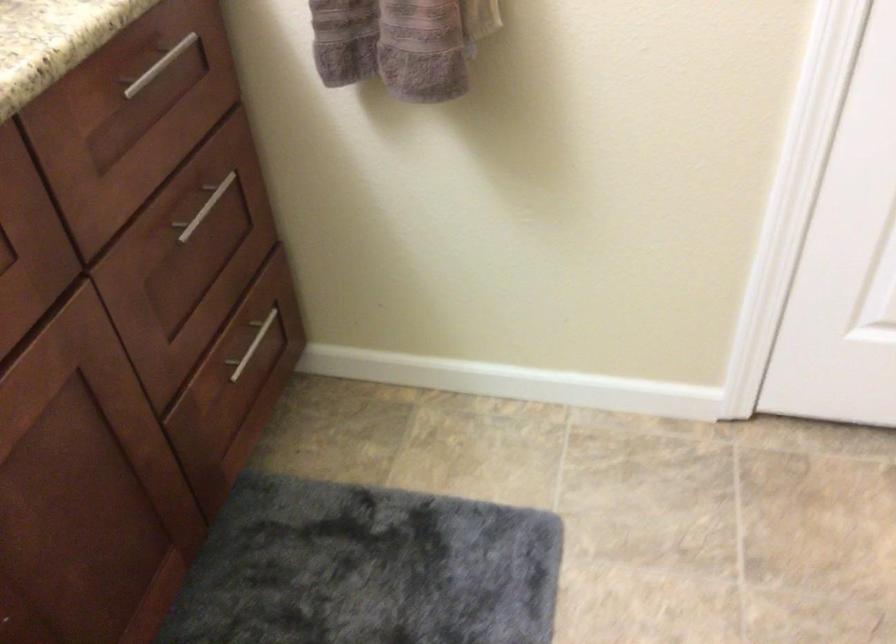
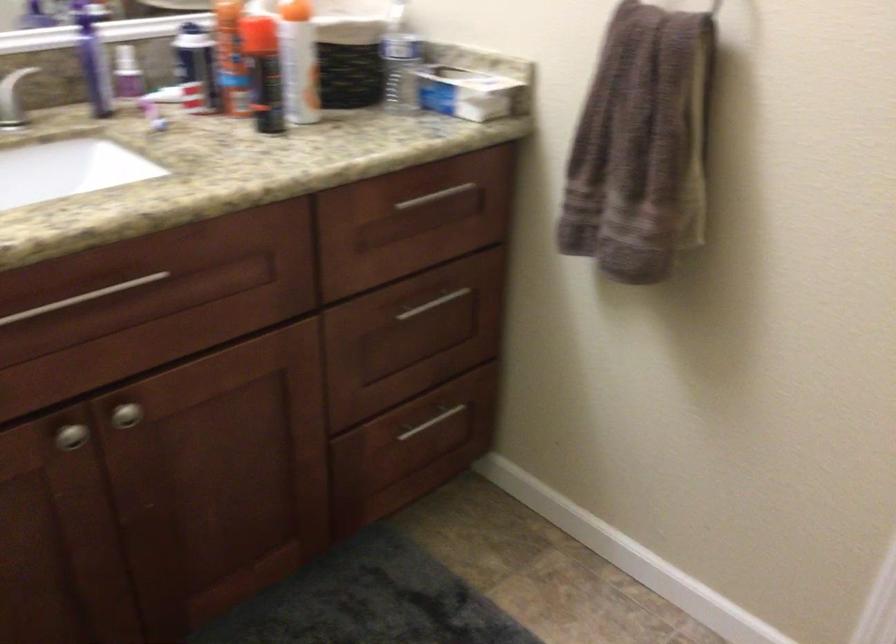
Find the pixel in the second image that matches point 257,343 in the first image.

(432, 422)